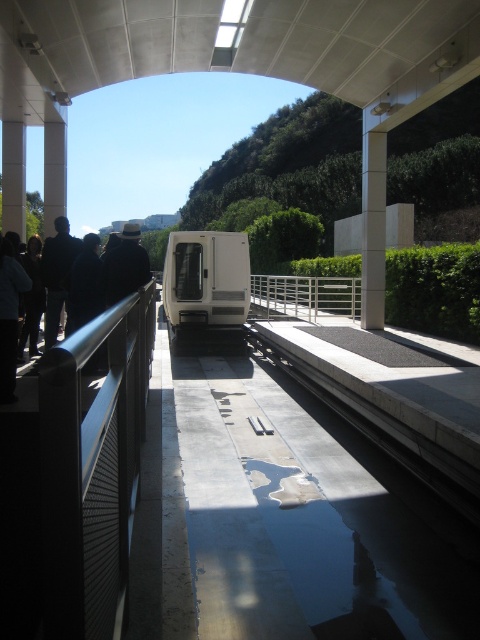
Who is positioned more to the right, white matte van at center or stainless steel railing at center?

stainless steel railing at center is more to the right.

Who is more distant from viewer, (x=172, y=276) or (x=315, y=305)?

The point (x=315, y=305) is behind.

Where is `white matte van at center`? white matte van at center is located at coordinates (206, 289).

Who is higher up, white matte van at center or dark blue jacket at left?

white matte van at center is above.

At what (x,y) coordinates should I click in order to perform the action: click on white matte van at center. Please return your answer as a coordinate pair (x, y). Looking at the image, I should click on (206, 289).

Does stainless steel railing at center appear on the left side of dark gray jacket at left?

No, stainless steel railing at center is not to the left of dark gray jacket at left.

Who is positioned more to the right, stainless steel railing at center or dark gray jacket at left?

From the viewer's perspective, stainless steel railing at center appears more on the right side.

Find the location of a particular element. stainless steel railing at center is located at coordinates (305, 296).

Locate an element on the screen. The image size is (480, 640). stainless steel railing at center is located at coordinates (305, 296).